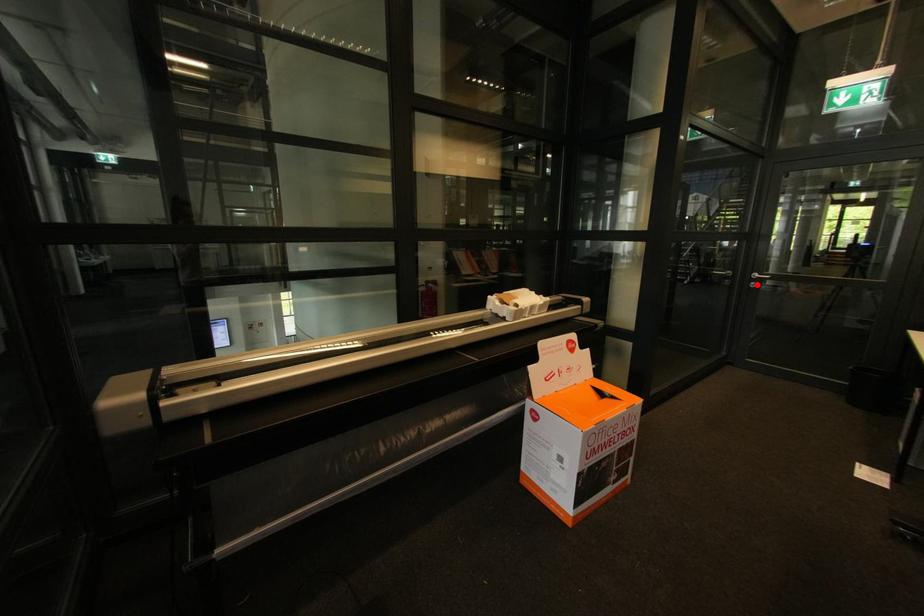
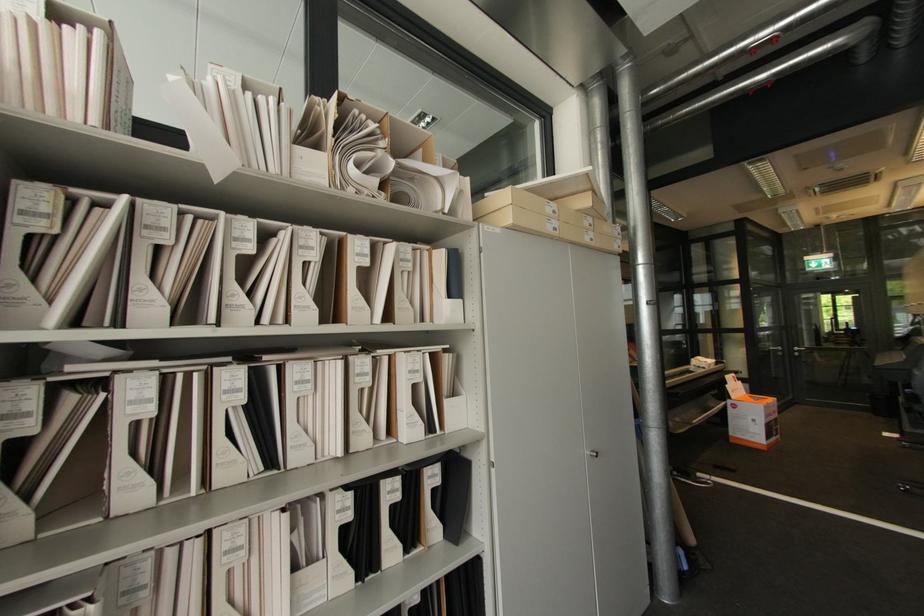
In the second image, find the point that corresponds to the highlighted location in the first image.

(800, 354)